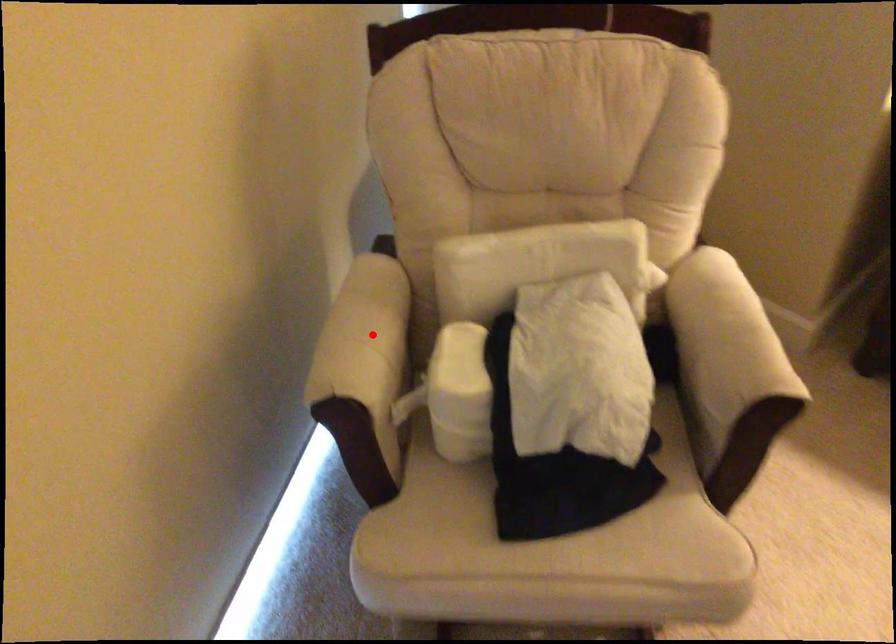
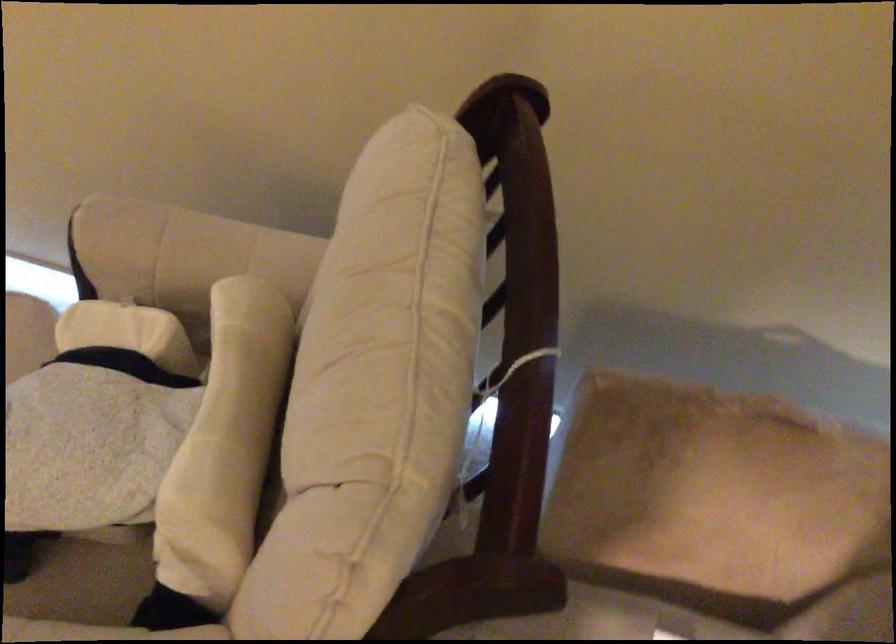
In the second image, find the point that corresponds to the highlighted location in the first image.

(181, 250)